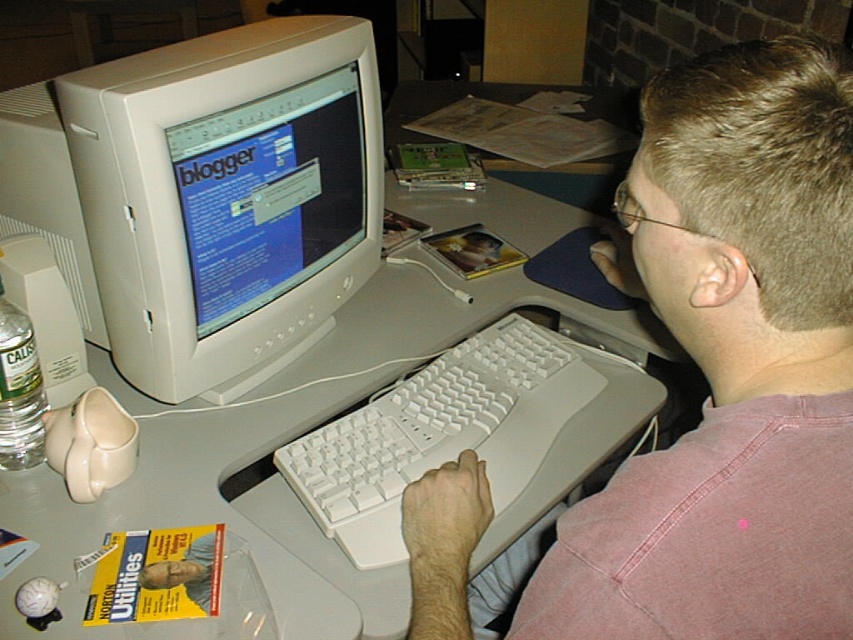
You are setting up a new desk and want to place the white plastic keyboard at center and the matte white monitor at center such that the keyboard is to the left of the monitor. Given their sizes, will the keyboard fit entirely to the left of the monitor without overlapping?

The white plastic keyboard at center is wider than the matte white monitor at center. Since the keyboard is larger in width, placing it entirely to the left of the monitor without overlapping would require more space than the monitor occupies. Therefore, it won

You are a person who needs to reach for the white plastic keyboard at center while sitting at the desk. Based on the description, where should you place your hand to reach it?

The white plastic keyboard at center is located at point (439, 433), so you should place your hand at that coordinate to reach it.

You are setting up a new desk and need to place the white plastic keyboard at center and the matte white monitor at center. Based on the scene, which object should be placed lower to ensure proper ergonomics?

The white plastic keyboard at center has a lesser height compared to the matte white monitor at center, so the keyboard should be placed lower to ensure proper ergonomics.